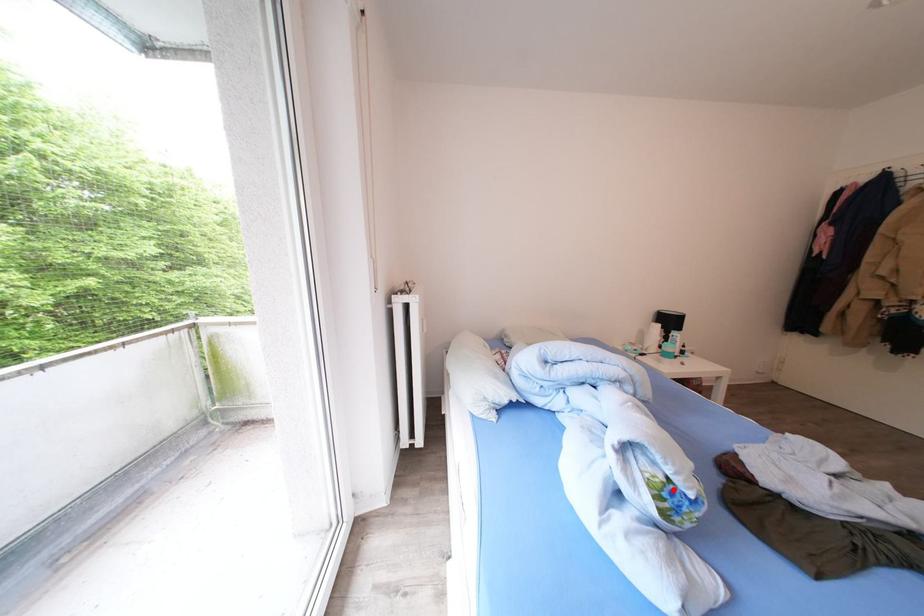
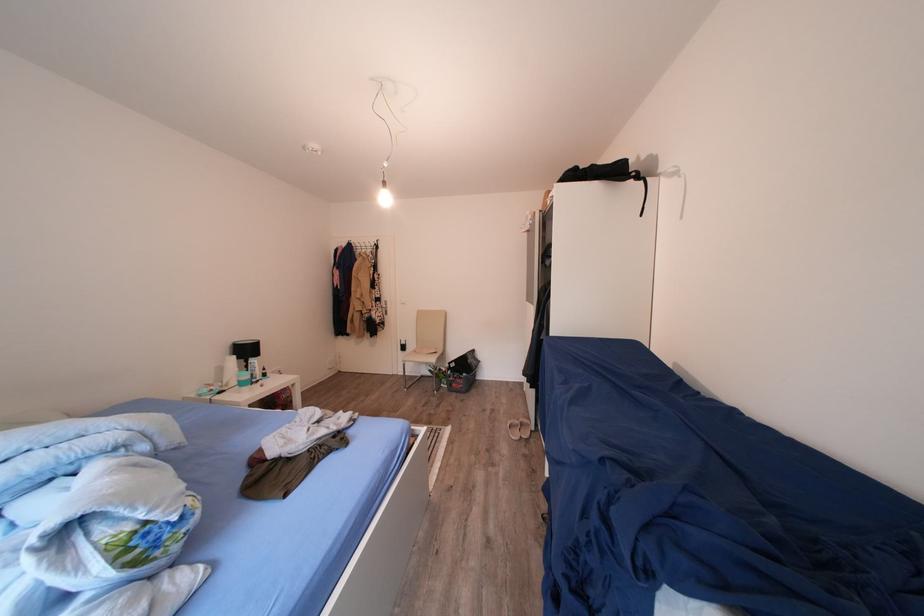
The point at the highlighted location is marked in the first image. Where is the corresponding point in the second image?

(142, 538)